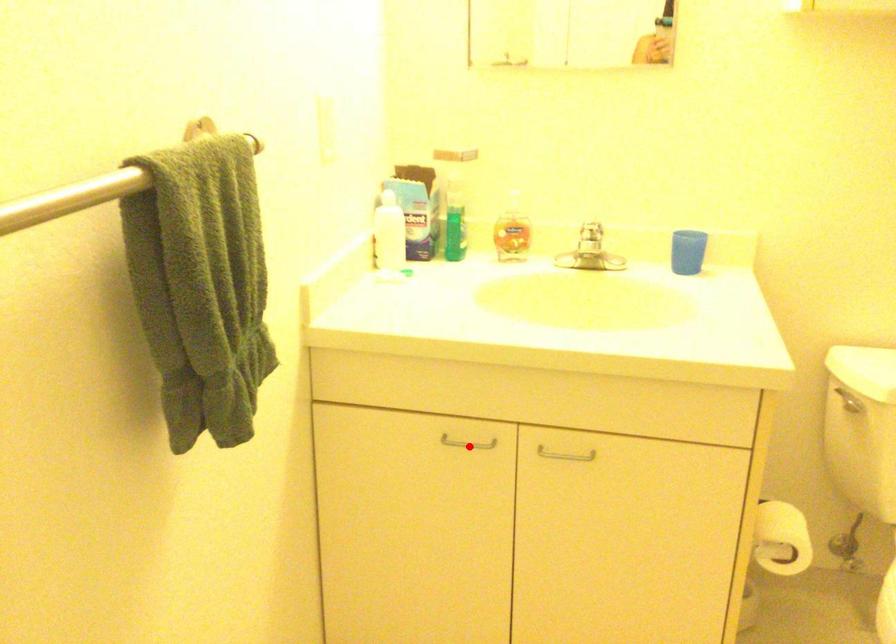
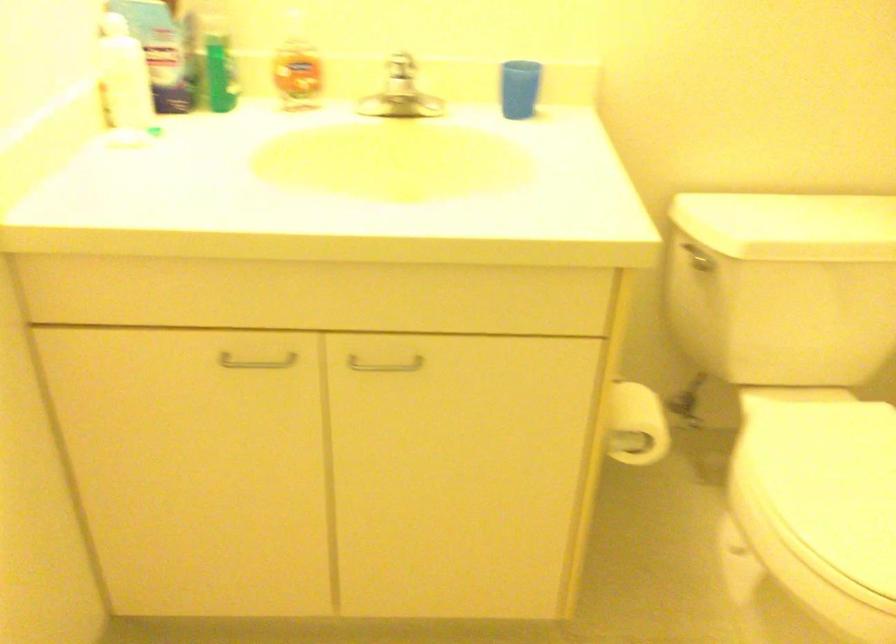
Question: A red point is marked in image1. In image2, is the corresponding 3D point closer to the camera or farther? Reply with the corresponding letter.

Choices:
 (A) The corresponding 3D point is closer.
 (B) The corresponding 3D point is farther.

Answer: (A)